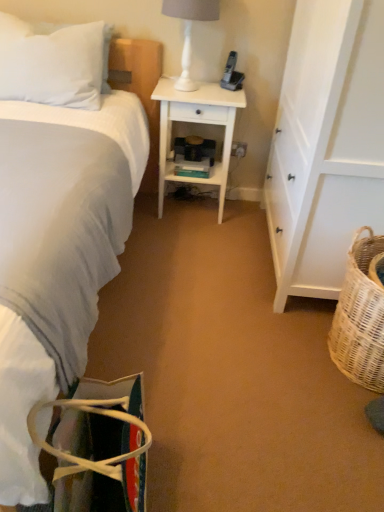
What is the approximate width of white soft pillow at upper left?

white soft pillow at upper left is 13.23 inches in width.

What do you see at coordinates (54, 63) in the screenshot? The image size is (384, 512). I see `white soft pillow at upper left` at bounding box center [54, 63].

Image resolution: width=384 pixels, height=512 pixels. What are the coordinates of `white plastic electric outlet at center` in the screenshot? It's located at (239, 149).

Image resolution: width=384 pixels, height=512 pixels. What do you see at coordinates (239, 149) in the screenshot? I see `white plastic electric outlet at center` at bounding box center [239, 149].

Describe the element at coordinates (197, 123) in the screenshot. I see `white wood desk at center` at that location.

Identify the location of woven wicker basket at lower right. (360, 317).

Image resolution: width=384 pixels, height=512 pixels. In order to click on black plastic phone at upper center in this screenshot , I will do [x=232, y=74].

Where is `white wood cabinet at right`? The height and width of the screenshot is (512, 384). white wood cabinet at right is located at coordinates point(326,145).

Find the location of a particular element. white glossy lamp at upper center is located at coordinates (189, 31).

What do you see at coordinates (103, 447) in the screenshot? This screenshot has width=384, height=512. I see `multicolored fabric bag at lower left` at bounding box center [103, 447].

The image size is (384, 512). I want to click on white soft pillow at upper left, so click(x=54, y=63).

Which point is more forward, (383,356) or (211,19)?

The point (383,356) is in front.

Is woven wicker basket at lower right aimed at white glossy lamp at upper center?

No, woven wicker basket at lower right is not oriented towards white glossy lamp at upper center.

Is woven wicker basket at lower right shorter than white glossy lamp at upper center?

In fact, woven wicker basket at lower right may be taller than white glossy lamp at upper center.

From the image's perspective, is woven wicker basket at lower right located above white glossy lamp at upper center?

No.

Is white soft pillow at upper left aimed at black plastic phone at upper center?

No, white soft pillow at upper left is not oriented towards black plastic phone at upper center.

Considering the sizes of white soft pillow at upper left and black plastic phone at upper center in the image, is white soft pillow at upper left wider or thinner than black plastic phone at upper center?

In the image, white soft pillow at upper left appears to be wider than black plastic phone at upper center.

Locate an element on the screen. pillow below the black plastic phone at upper center (from the image's perspective) is located at coordinates (x=54, y=63).

Is white glossy lamp at upper center wider than multicolored fabric bag at lower left?

No, white glossy lamp at upper center is not wider than multicolored fabric bag at lower left.

Locate an element on the screen. The width and height of the screenshot is (384, 512). handbag in front of the white glossy lamp at upper center is located at coordinates (103, 447).

Is white glossy lamp at upper center next to multicolored fabric bag at lower left?

No, white glossy lamp at upper center is not next to multicolored fabric bag at lower left.

Is multicolored fabric bag at lower left at the back of white glossy lamp at upper center?

That's not correct — white glossy lamp at upper center is not looking away from multicolored fabric bag at lower left.

Is white soft bed at left next to white wood cabinet at right?

white soft bed at left is not next to white wood cabinet at right, and they're not touching.

Is white wood cabinet at right at the back of white soft bed at left?

No, white soft bed at left is not facing away from white wood cabinet at right.

Between white soft bed at left and white wood cabinet at right, which one has smaller width?

With smaller width is white wood cabinet at right.

Can you confirm if multicolored fabric bag at lower left is shorter than white soft pillow at upper left?

Yes.

Is multicolored fabric bag at lower left outside of white soft pillow at upper left?

Yes, multicolored fabric bag at lower left is located beyond the bounds of white soft pillow at upper left.

In the scene shown: Is multicolored fabric bag at lower left oriented towards white soft pillow at upper left?

Yes, multicolored fabric bag at lower left is oriented towards white soft pillow at upper left.

Is white plastic electric outlet at center to the right of white glossy lamp at upper center from the viewer's perspective?

Correct, you'll find white plastic electric outlet at center to the right of white glossy lamp at upper center.

Is there a large distance between white plastic electric outlet at center and white glossy lamp at upper center?

No, white plastic electric outlet at center is in close proximity to white glossy lamp at upper center.

Considering the sizes of objects white plastic electric outlet at center and white glossy lamp at upper center in the image provided, who is smaller, white plastic electric outlet at center or white glossy lamp at upper center?

Smaller between the two is white plastic electric outlet at center.

Based on the photo, from the image's perspective, who appears lower, multicolored fabric bag at lower left or white soft bed at left?

multicolored fabric bag at lower left appears lower in the image.

Is point (40, 442) farther from viewer compared to point (19, 494)?

Yes, point (40, 442) is behind point (19, 494).

Is multicolored fabric bag at lower left facing towards white soft bed at left?

Yes, multicolored fabric bag at lower left faces towards white soft bed at left.

Locate an element on the screen. This screenshot has height=512, width=384. bed located above the multicolored fabric bag at lower left (from the image's perspective) is located at coordinates (29, 384).

Locate an element on the screen. lamp located above the woven wicker basket at lower right (from the image's perspective) is located at coordinates (189, 31).

Identify the location of pillow located on the left of black plastic phone at upper center. This screenshot has width=384, height=512. (54, 63).

Based on their spatial positions, is white wood cabinet at right or white plastic electric outlet at center further from white wood desk at center?

white wood cabinet at right lies further to white wood desk at center than the other object.

Considering their positions, is black plastic phone at upper center positioned closer to white wood cabinet at right than woven wicker basket at lower right?

Based on the image, woven wicker basket at lower right appears to be nearer to white wood cabinet at right.

When comparing their distances from white soft bed at left, does black plastic phone at upper center or white wood desk at center seem further?

black plastic phone at upper center lies further to white soft bed at left than the other object.

Looking at the image, which one is located further to black plastic phone at upper center, white plastic electric outlet at center or white wood cabinet at right?

white wood cabinet at right is further to black plastic phone at upper center.

Looking at the image, which one is located further to white wood cabinet at right, woven wicker basket at lower right or white glossy lamp at upper center?

Based on the image, white glossy lamp at upper center appears to be further to white wood cabinet at right.

Consider the image. Considering their positions, is black plastic phone at upper center positioned closer to white plastic electric outlet at center than multicolored fabric bag at lower left?

black plastic phone at upper center.

Looking at the image, which one is located closer to white glossy lamp at upper center, white wood desk at center or woven wicker basket at lower right?

white wood desk at center.

Considering their positions, is white wood cabinet at right positioned closer to white wood desk at center than black plastic phone at upper center?

black plastic phone at upper center.

This screenshot has height=512, width=384. Identify the location of cabinetry between black plastic phone at upper center and woven wicker basket at lower right vertically. (326, 145).

At what (x,y) coordinates should I click in order to perform the action: click on picnic basket located between white soft bed at left and white wood desk at center in the depth direction. Please return your answer as a coordinate pair (x, y). Looking at the image, I should click on (360, 317).

I want to click on desk between white soft pillow at upper left and white wood cabinet at right in the horizontal direction, so click(x=197, y=123).

This screenshot has height=512, width=384. I want to click on corded phone positioned between woven wicker basket at lower right and white plastic electric outlet at center from near to far, so click(232, 74).